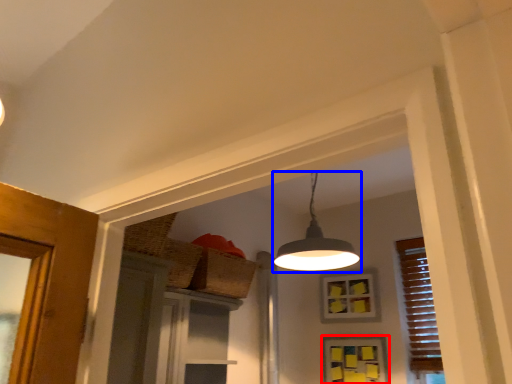
Question: Which object is closer to the camera taking this photo, window (highlighted by a red box) or lamp (highlighted by a blue box)?

Choices:
 (A) window
 (B) lamp

Answer: (B)